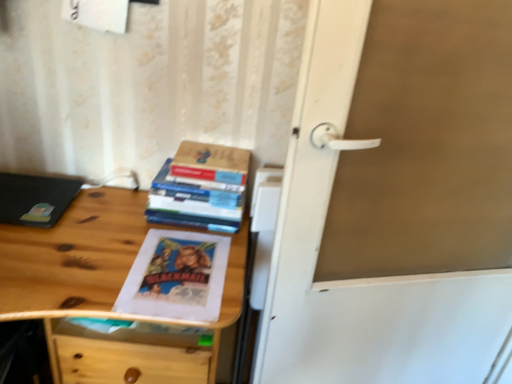
You are a GUI agent. You are given a task and a screenshot of the screen. Output one action in this format:
    pyautogui.click(x=<x>, y=<y>)
    Task: Click on the vacant space situated above wooden desk at left (from a real-world perspective)
    
    Given the screenshot: What is the action you would take?
    pyautogui.click(x=94, y=250)